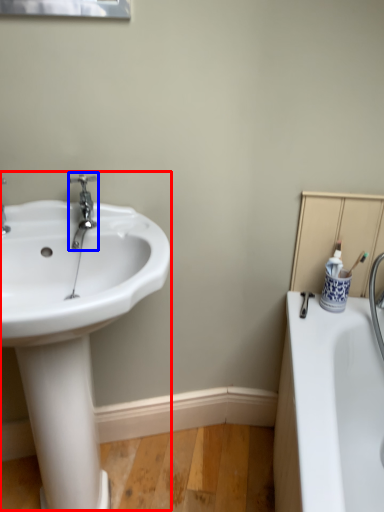
Question: Which of the following is the farthest to the observer, sink (highlighted by a red box) or tap (highlighted by a blue box)?

Choices:
 (A) sink
 (B) tap

Answer: (B)